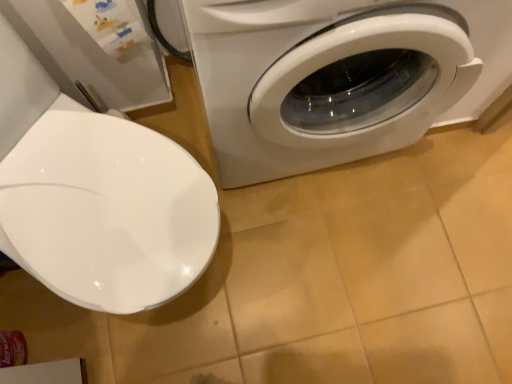
Question: From their relative heights in the image, would you say white glossy washing machine at right is taller or shorter than white glossy toilet seat at left?

Choices:
 (A) tall
 (B) short

Answer: (A)

Question: Is white glossy washing machine at right bigger or smaller than white glossy toilet seat at left?

Choices:
 (A) big
 (B) small

Answer: (A)

Question: Which is correct: white glossy washing machine at right is inside white glossy toilet seat at left, or outside of it?

Choices:
 (A) outside
 (B) inside

Answer: (A)

Question: From the image's perspective, is white glossy toilet seat at left positioned above or below white glossy washing machine at right?

Choices:
 (A) below
 (B) above

Answer: (A)

Question: Is white glossy toilet seat at left in front of or behind white glossy washing machine at right in the image?

Choices:
 (A) front
 (B) behind

Answer: (A)

Question: Is white glossy toilet seat at left wider or thinner than white glossy washing machine at right?

Choices:
 (A) thin
 (B) wide

Answer: (B)

Question: From their relative heights in the image, would you say white glossy toilet seat at left is taller or shorter than white glossy washing machine at right?

Choices:
 (A) short
 (B) tall

Answer: (A)